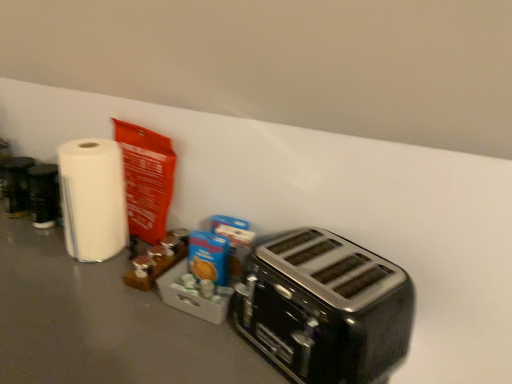
Locate an element on the screen. This screenshot has height=384, width=512. vacant area situated to the left side of white glossy paper towel at left is located at coordinates (30, 246).